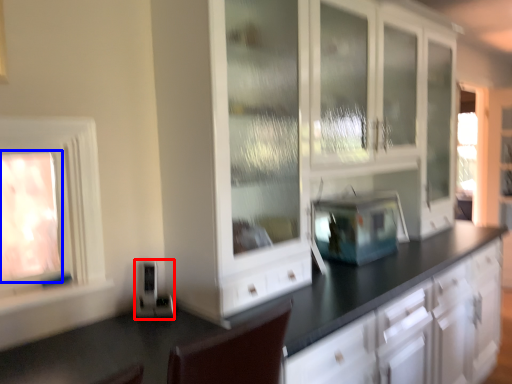
Question: Among these objects, which one is farthest to the camera, appliance (highlighted by a red box) or window (highlighted by a blue box)?

Choices:
 (A) appliance
 (B) window

Answer: (A)